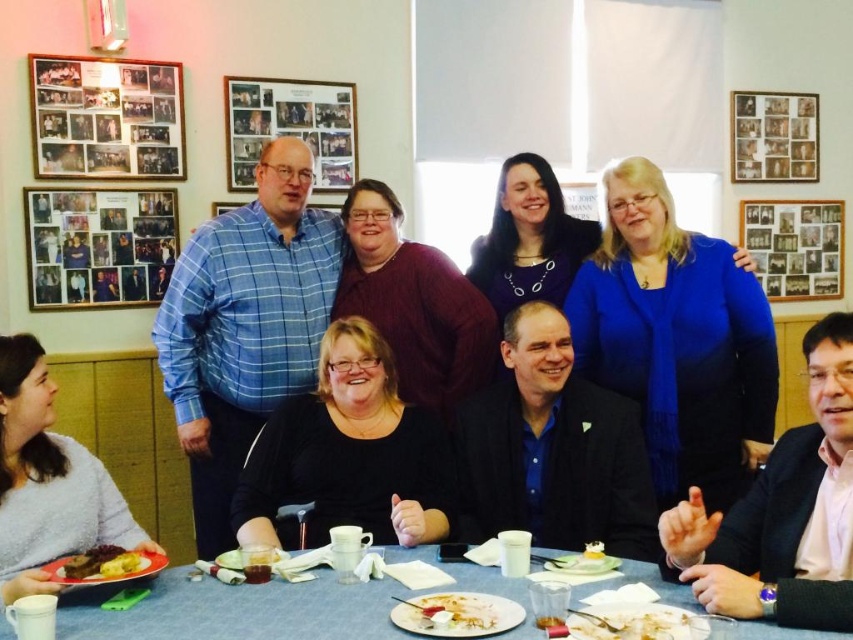
Question: Which object is the farthest from the white paper plate at lower center?

Choices:
 (A) white creamy food at lower center
 (B) pink satin shirt at lower right

Answer: (B)

Question: Which of these objects is positioned farthest from the white creamy food at lower center?

Choices:
 (A) white paper plate at lower center
 (B) blue fabric table at lower center
 (C) fluffy white sweater at lower left

Answer: (C)

Question: Is white porcelain plate at lower center above white creamy food at lower center?

Choices:
 (A) no
 (B) yes

Answer: (B)

Question: Considering the relative positions of white creamy food at lower center and golden brown bread at lower left in the image provided, where is white creamy food at lower center located with respect to golden brown bread at lower left?

Choices:
 (A) left
 (B) right

Answer: (B)

Question: Does white porcelain plate at lower center have a greater width compared to white creamy food at lower center?

Choices:
 (A) no
 (B) yes

Answer: (B)

Question: Which object is positioned farthest from the white creamy food at lower center?

Choices:
 (A) blue fabric table at lower center
 (B) pink satin shirt at lower right
 (C) white porcelain plate at lower center
 (D) fluffy white sweater at lower left

Answer: (D)